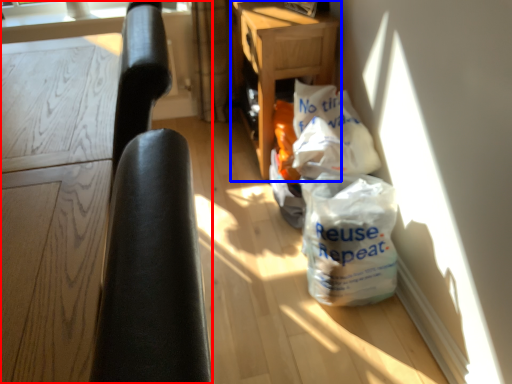
Question: Which point is further to the camera, furniture (highlighted by a red box) or table (highlighted by a blue box)?

Choices:
 (A) furniture
 (B) table

Answer: (B)